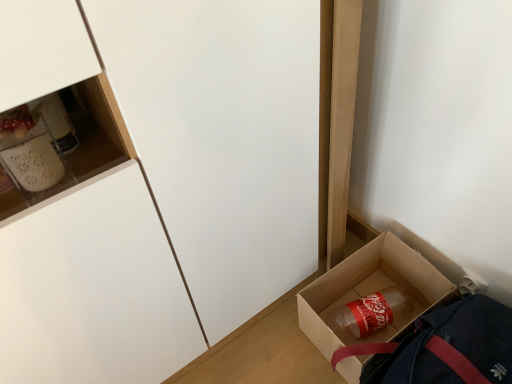
Question: Considering the relative positions of matte white cabinet at lower left and translucent plastic bottle at lower right in the image provided, is matte white cabinet at lower left to the left or to the right of translucent plastic bottle at lower right?

Choices:
 (A) left
 (B) right

Answer: (A)

Question: Considering their positions, is matte white cabinet at lower left located in front of or behind translucent plastic bottle at lower right?

Choices:
 (A) behind
 (B) front

Answer: (B)

Question: Which object is the closest to the translucent plastic bottle at lower right?

Choices:
 (A) brown cardboard box at lower right
 (B) matte white cabinet at lower left

Answer: (A)

Question: Which object is positioned closest to the translucent plastic bottle at lower right?

Choices:
 (A) matte white cabinet at lower left
 (B) brown cardboard box at lower right

Answer: (B)